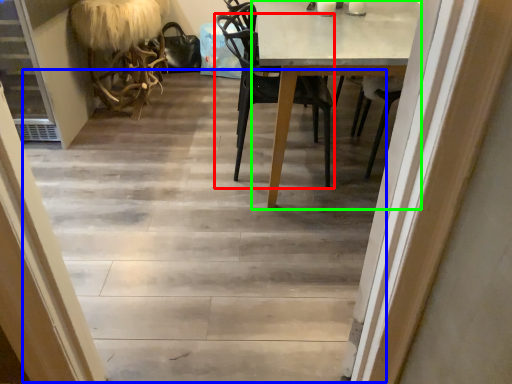
Question: Based on their relative distances, which object is nearer to chair (highlighted by a red box)? Choose from stairwell (highlighted by a blue box) and round table (highlighted by a green box).

Choices:
 (A) stairwell
 (B) round table

Answer: (B)